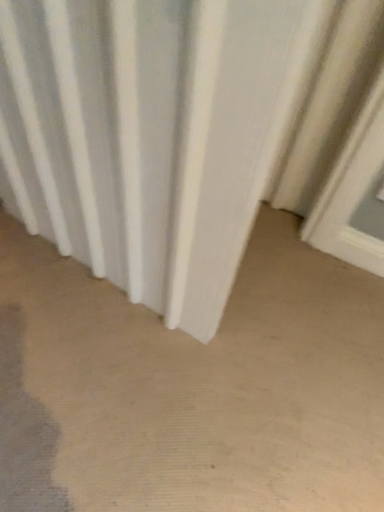
The width and height of the screenshot is (384, 512). Identify the location of beige carpet at center. (191, 387).

What is the approximate height of beige carpet at center?

1.41 inches.

The width and height of the screenshot is (384, 512). What do you see at coordinates (191, 387) in the screenshot?
I see `beige carpet at center` at bounding box center [191, 387].

Find the location of `beige carpet at center`. beige carpet at center is located at coordinates (191, 387).